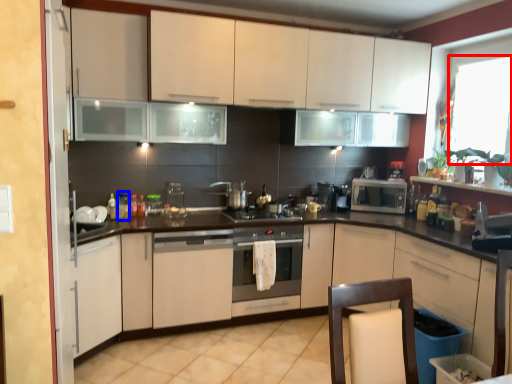
Question: Which object appears closest to the camera in this image, window screen (highlighted by a red box) or bottle (highlighted by a blue box)?

Choices:
 (A) window screen
 (B) bottle

Answer: (A)